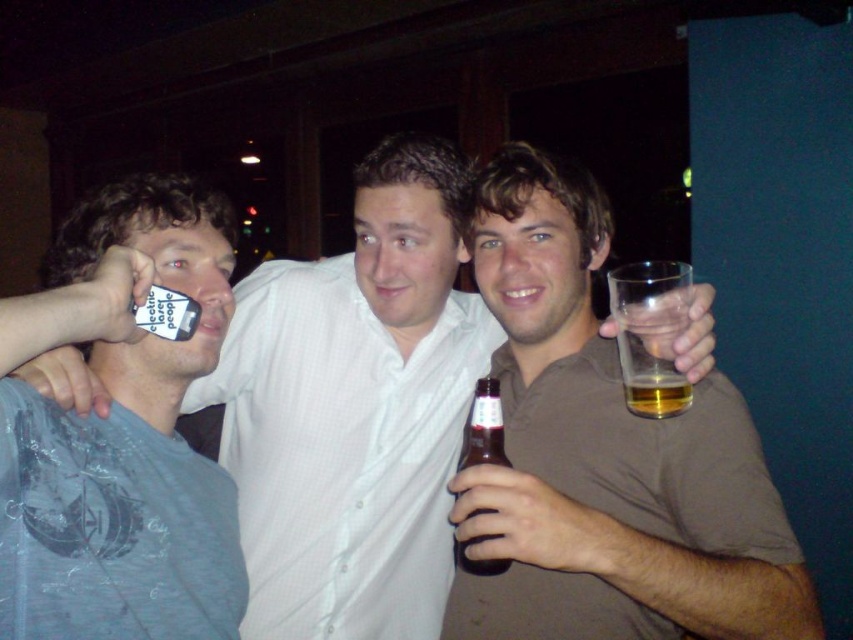
Is translucent glass at right below translucent glass beer at right?

No.

From the picture: How distant is translucent glass at right from translucent glass beer at right?

translucent glass at right and translucent glass beer at right are 1.86 inches apart.

At what (x,y) coordinates should I click in order to perform the action: click on translucent glass at right. Please return your answer as a coordinate pair (x, y). The height and width of the screenshot is (640, 853). Looking at the image, I should click on (651, 333).

Locate an element on the screen. The height and width of the screenshot is (640, 853). translucent glass at right is located at coordinates (651, 333).

Does matte white shirt at center appear on the left side of brown matte glass at right?

Indeed, matte white shirt at center is positioned on the left side of brown matte glass at right.

Is matte white shirt at center thinner than brown matte glass at right?

Incorrect, matte white shirt at center's width is not less than brown matte glass at right's.

In order to click on matte white shirt at center in this screenshot , I will do `click(355, 408)`.

This screenshot has height=640, width=853. Identify the location of matte white shirt at center. (355, 408).

Looking at this image, between brown matte glass at right and translucent glass beer at right, which one has more height?

Standing taller between the two is brown matte glass at right.

The height and width of the screenshot is (640, 853). In order to click on brown matte glass at right in this screenshot , I will do `click(604, 456)`.

Between point (703, 545) and point (630, 406), which one is positioned in front?

Point (703, 545) is in front.

This screenshot has height=640, width=853. What are the coordinates of `brown matte glass at right` in the screenshot? It's located at (604, 456).